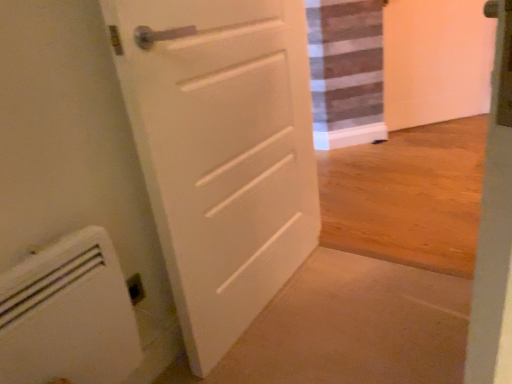
Question: Is the depth of white plastic radiator at lower left less than that of white matte door at center?

Choices:
 (A) yes
 (B) no

Answer: (A)

Question: Is white plastic radiator at lower left touching white matte door at center?

Choices:
 (A) no
 (B) yes

Answer: (A)

Question: From the image's perspective, is white plastic radiator at lower left below white matte door at center?

Choices:
 (A) no
 (B) yes

Answer: (B)

Question: Is white plastic radiator at lower left smaller than white matte door at center?

Choices:
 (A) no
 (B) yes

Answer: (B)

Question: Is there a large distance between white plastic radiator at lower left and white matte door at center?

Choices:
 (A) yes
 (B) no

Answer: (B)

Question: Is white matte door at center a part of white plastic radiator at lower left?

Choices:
 (A) no
 (B) yes

Answer: (A)

Question: Does white matte door at center have a lesser width compared to white plastic radiator at lower left?

Choices:
 (A) yes
 (B) no

Answer: (B)

Question: Considering the relative sizes of white matte door at center and white plastic radiator at lower left in the image provided, is white matte door at center bigger than white plastic radiator at lower left?

Choices:
 (A) yes
 (B) no

Answer: (A)

Question: Does white matte door at center turn towards white plastic radiator at lower left?

Choices:
 (A) yes
 (B) no

Answer: (B)

Question: Is white matte door at center behind white plastic radiator at lower left?

Choices:
 (A) yes
 (B) no

Answer: (A)

Question: Is white matte door at center taller than white plastic radiator at lower left?

Choices:
 (A) yes
 (B) no

Answer: (A)

Question: Considering the relative sizes of white matte door at center and white plastic radiator at lower left in the image provided, is white matte door at center smaller than white plastic radiator at lower left?

Choices:
 (A) no
 (B) yes

Answer: (A)

Question: From the image's perspective, is white plastic radiator at lower left positioned above or below white matte door at center?

Choices:
 (A) below
 (B) above

Answer: (A)